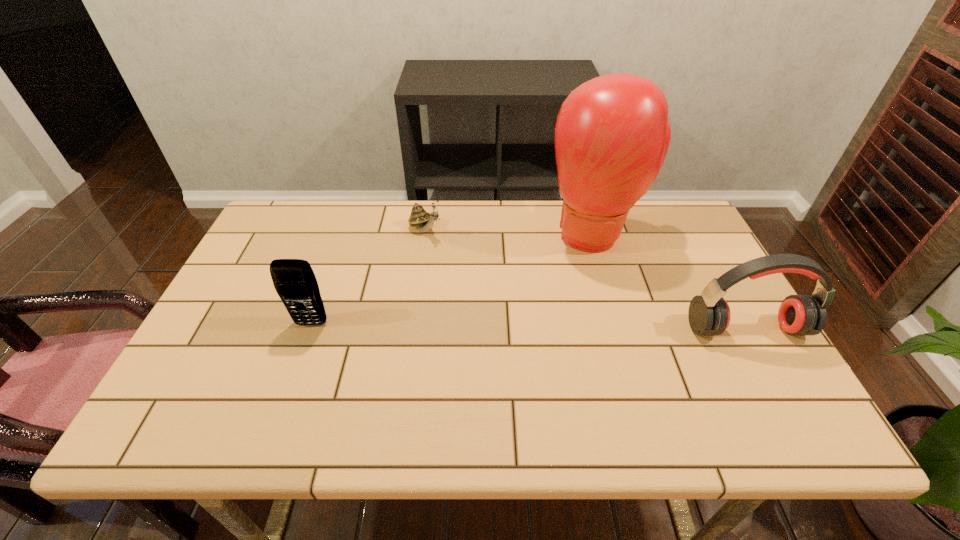
Image resolution: width=960 pixels, height=540 pixels. I want to click on vacant spot on the desktop that is between the cellular telephone and the rightmost object and is positioned on the face of the snail, so click(560, 327).

Locate an element on the screen. The height and width of the screenshot is (540, 960). free spot on the desktop that is between the cellular telephone and the earphone and is positioned on the striking surface of the boxing glove is located at coordinates (586, 327).